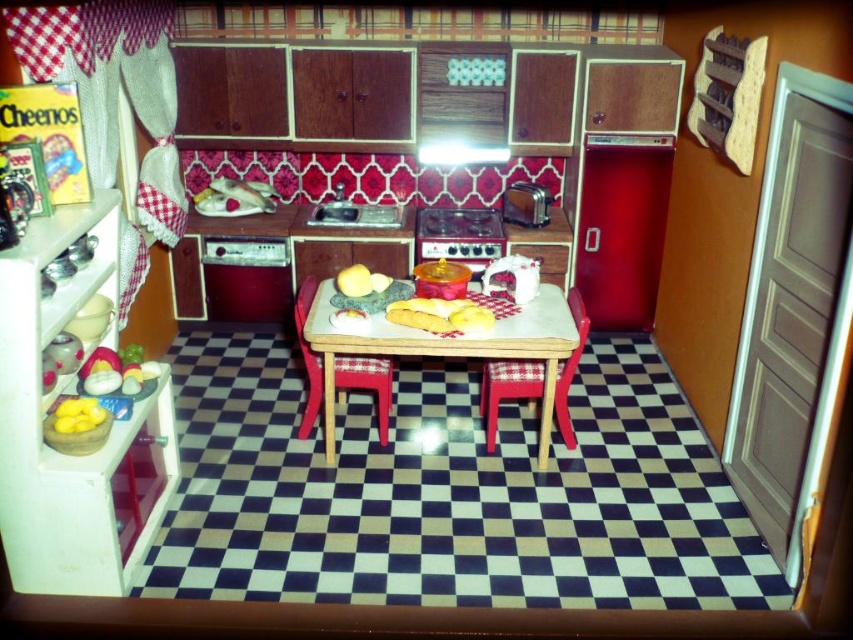
Does red fabric chair at center appear over yellow matte apple at center?

No.

Does red fabric chair at center appear on the right side of yellow matte apple at center?

In fact, red fabric chair at center is to the left of yellow matte apple at center.

Does point (347, 364) come behind point (345, 280)?

Yes, it is.

This screenshot has height=640, width=853. Find the location of `red fabric chair at center`. red fabric chair at center is located at coordinates (368, 381).

Is point (577, 292) positioned before point (99, 404)?

No, (577, 292) is further to viewer.

Is red checkered fabric chair at center closer to the viewer compared to yellow matte eggs at center?

No, red checkered fabric chair at center is behind yellow matte eggs at center.

Between point (529, 369) and point (91, 424), which one is positioned in front?

Point (91, 424) is more forward.

At what (x,y) coordinates should I click in order to perform the action: click on red checkered fabric chair at center. Please return your answer as a coordinate pair (x, y). The width and height of the screenshot is (853, 640). Looking at the image, I should click on (508, 388).

In the scene shown: Does yellow matte bread at center lie behind yellow matte apple at center?

Result: No, it is not.

Based on the photo, is yellow matte bread at center wider than yellow matte apple at center?

In fact, yellow matte bread at center might be narrower than yellow matte apple at center.

Who is more distant from viewer, (x=465, y=305) or (x=364, y=292)?

The point (x=364, y=292) is behind.

I want to click on yellow matte bread at center, so click(471, 317).